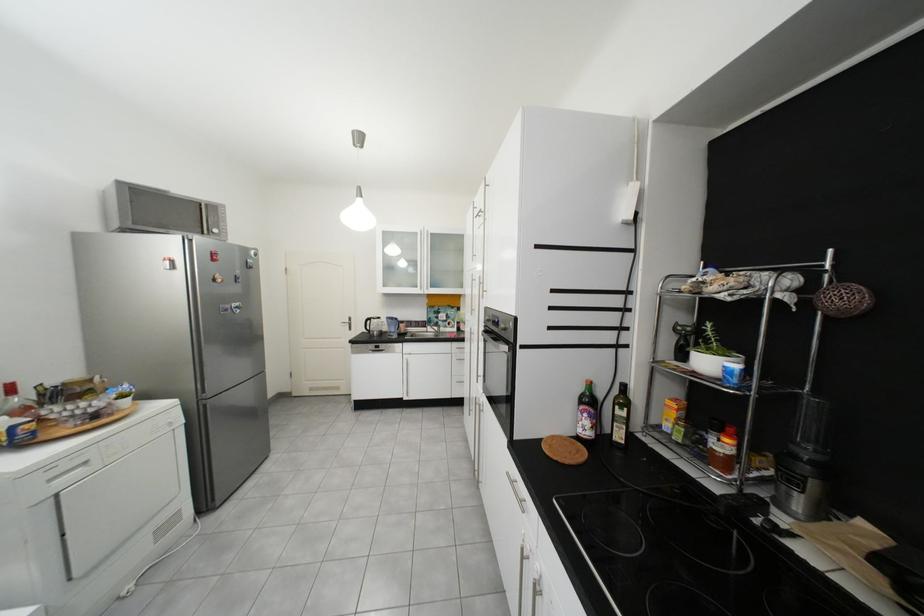
This screenshot has width=924, height=616. In order to click on oven door handle in this screenshot , I will do `click(495, 344)`.